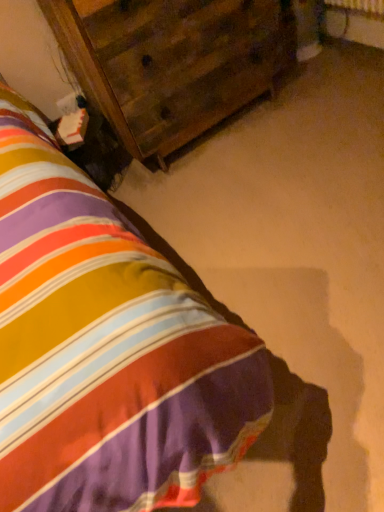
Question: Can you confirm if wooden nightstand at center is taller than wooden dresser at upper left?

Choices:
 (A) yes
 (B) no

Answer: (B)

Question: Can you confirm if wooden nightstand at center is shorter than wooden dresser at upper left?

Choices:
 (A) yes
 (B) no

Answer: (A)

Question: Is wooden dresser at upper left located within wooden nightstand at center?

Choices:
 (A) yes
 (B) no

Answer: (B)

Question: Is wooden nightstand at center closer to the viewer compared to wooden dresser at upper left?

Choices:
 (A) yes
 (B) no

Answer: (A)

Question: From the image's perspective, is wooden nightstand at center on top of wooden dresser at upper left?

Choices:
 (A) no
 (B) yes

Answer: (A)

Question: Is wooden nightstand at center bigger than wooden dresser at upper left?

Choices:
 (A) no
 (B) yes

Answer: (A)

Question: Can you confirm if wooden dresser at upper left is positioned to the left of wooden nightstand at center?

Choices:
 (A) no
 (B) yes

Answer: (B)

Question: Is wooden dresser at upper left outside wooden nightstand at center?

Choices:
 (A) yes
 (B) no

Answer: (A)

Question: Does wooden dresser at upper left have a lesser height compared to wooden nightstand at center?

Choices:
 (A) no
 (B) yes

Answer: (A)

Question: From a real-world perspective, is wooden dresser at upper left located beneath wooden nightstand at center?

Choices:
 (A) yes
 (B) no

Answer: (B)

Question: Is wooden dresser at upper left bigger than wooden nightstand at center?

Choices:
 (A) yes
 (B) no

Answer: (A)

Question: Does wooden dresser at upper left have a greater height compared to wooden nightstand at center?

Choices:
 (A) no
 (B) yes

Answer: (B)

Question: In the image, is wooden dresser at upper left on the left side or the right side of wooden nightstand at center?

Choices:
 (A) left
 (B) right

Answer: (A)